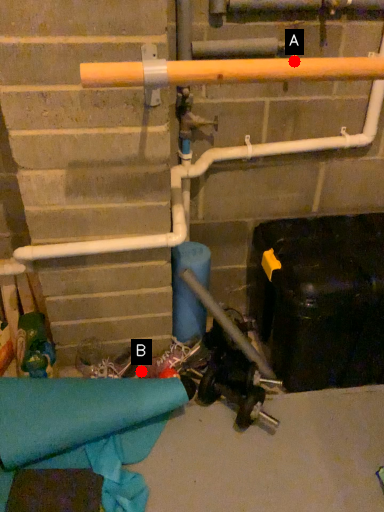
Question: Two points are circled on the image, labeled by A and B beside each circle. Which of the following is the farthest from the observer?

Choices:
 (A) A is further
 (B) B is further

Answer: (B)